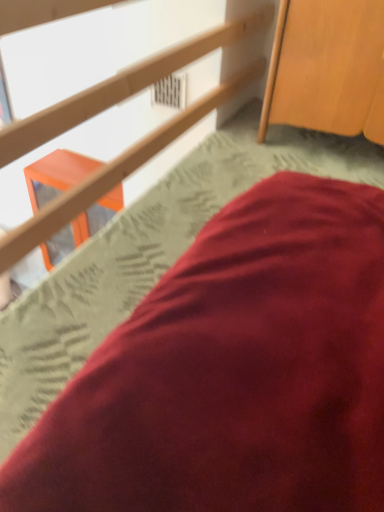
Question: Is satin red pillow at lower right with matte wood rail at upper center?

Choices:
 (A) yes
 (B) no

Answer: (B)

Question: Is satin red pillow at lower right aimed at matte wood rail at upper center?

Choices:
 (A) no
 (B) yes

Answer: (A)

Question: From a real-world perspective, is satin red pillow at lower right on matte wood rail at upper center?

Choices:
 (A) yes
 (B) no

Answer: (B)

Question: Is satin red pillow at lower right looking in the opposite direction of matte wood rail at upper center?

Choices:
 (A) yes
 (B) no

Answer: (B)

Question: Does satin red pillow at lower right have a lesser height compared to matte wood rail at upper center?

Choices:
 (A) no
 (B) yes

Answer: (B)

Question: Is satin red pillow at lower right completely or partially outside of matte wood rail at upper center?

Choices:
 (A) no
 (B) yes

Answer: (B)

Question: Considering the relative sizes of matte wood rail at upper center and satin red pillow at lower right in the image provided, is matte wood rail at upper center thinner than satin red pillow at lower right?

Choices:
 (A) no
 (B) yes

Answer: (A)

Question: Is there a large distance between matte wood rail at upper center and satin red pillow at lower right?

Choices:
 (A) yes
 (B) no

Answer: (B)

Question: Does matte wood rail at upper center have a lesser height compared to satin red pillow at lower right?

Choices:
 (A) no
 (B) yes

Answer: (A)

Question: Is matte wood rail at upper center to the right of satin red pillow at lower right from the viewer's perspective?

Choices:
 (A) no
 (B) yes

Answer: (A)

Question: From a real-world perspective, does matte wood rail at upper center stand above satin red pillow at lower right?

Choices:
 (A) yes
 (B) no

Answer: (A)

Question: From a real-world perspective, is matte wood rail at upper center positioned under satin red pillow at lower right based on gravity?

Choices:
 (A) no
 (B) yes

Answer: (A)

Question: From a real-world perspective, is wooden cabinet at upper right physically below matte wood rail at upper center?

Choices:
 (A) yes
 (B) no

Answer: (A)